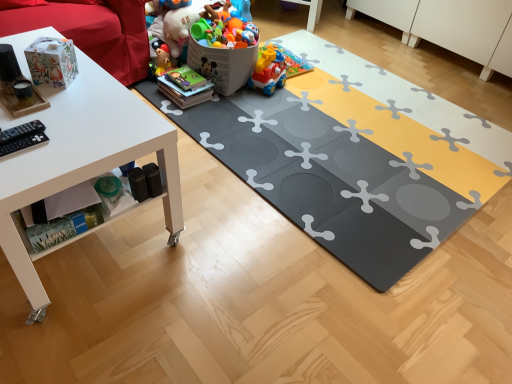
Where is `vacant area that is situated to the right of white matte table at left`? This screenshot has width=512, height=384. vacant area that is situated to the right of white matte table at left is located at coordinates (234, 279).